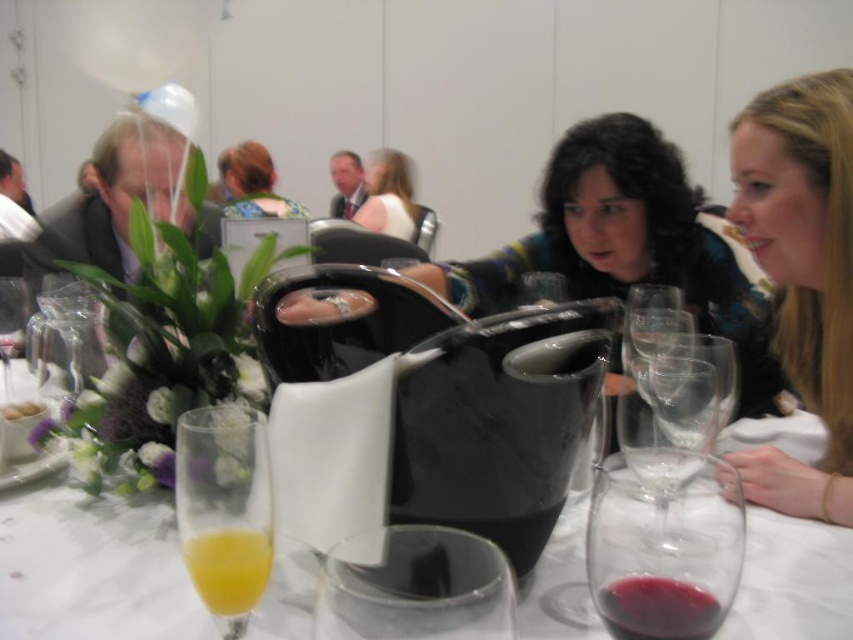
Question: Among these objects, which one is farthest from the camera?

Choices:
 (A) translucent glass flute at lower left
 (B) black plastic pitcher at center
 (C) clear glass wine glass at center

Answer: (B)

Question: Which of these objects is positioned closest to the shiny black dress at center?

Choices:
 (A) clear glass wine glass at center
 (B) white creamy cheese at center
 (C) matte white dress at center
 (D) black plastic pitcher at center

Answer: (D)

Question: Can you confirm if clear glass wine glass at center is positioned to the right of transparent plastic wine glass at left?

Choices:
 (A) yes
 (B) no

Answer: (A)

Question: Does black plastic pitcher at center appear under clear glass wine glass at center?

Choices:
 (A) yes
 (B) no

Answer: (A)

Question: Among these objects, which one is farthest from the camera?

Choices:
 (A) green floral dress at upper center
 (B) black plastic pitcher at center

Answer: (A)

Question: Can you confirm if transparent plastic wine glass at left is positioned below white creamy cheese at center?

Choices:
 (A) no
 (B) yes

Answer: (A)